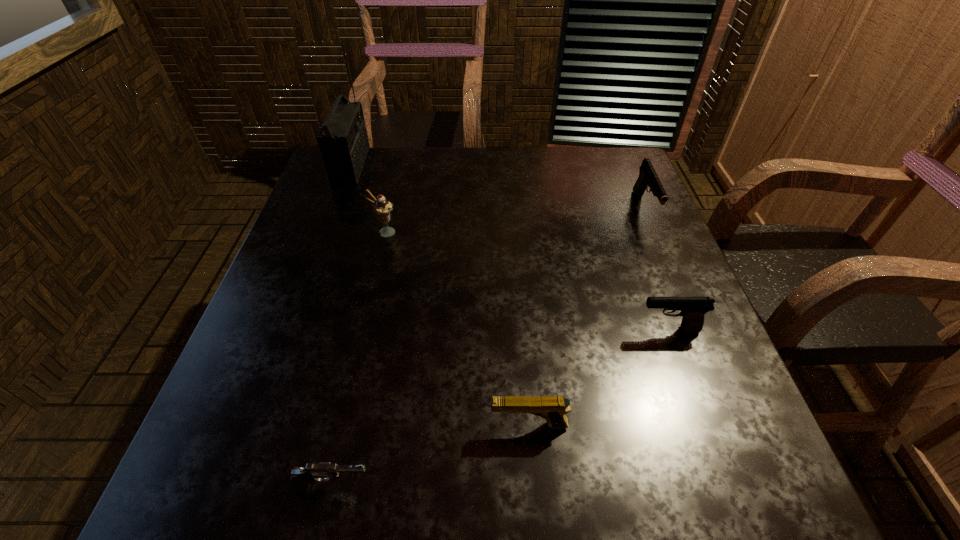
Image resolution: width=960 pixels, height=540 pixels. In order to click on pistol located at the far edge in this screenshot , I will do `click(647, 177)`.

Locate an element on the screen. This screenshot has width=960, height=540. object that is at the near edge is located at coordinates (300, 479).

At what (x,y) coordinates should I click in order to perform the action: click on object at the left edge. Please return your answer as a coordinate pair (x, y). Image resolution: width=960 pixels, height=540 pixels. Looking at the image, I should click on (343, 141).

Find the location of a particular element. This screenshot has height=540, width=960. object situated at the far left corner is located at coordinates (343, 141).

Locate an element on the screen. object at the far right corner is located at coordinates (647, 177).

You are a GUI agent. You are given a task and a screenshot of the screen. Output one action in this format:
    pyautogui.click(x=<x>, y=<y>)
    Task: Click on the free space at the far edge of the desktop
    This screenshot has height=540, width=960.
    Given the screenshot: What is the action you would take?
    pyautogui.click(x=387, y=157)

In the image, there is a desktop. Where is `vacant space at the right edge`? The image size is (960, 540). vacant space at the right edge is located at coordinates (708, 432).

You are a GUI agent. You are given a task and a screenshot of the screen. Output one action in this format:
    pyautogui.click(x=<x>, y=<y>)
    Task: Click on the vacant space at the far left corner of the desktop
    This screenshot has height=540, width=960.
    Given the screenshot: What is the action you would take?
    tap(373, 179)

In order to click on blank area at the near left corner in this screenshot , I will do 285,493.

This screenshot has height=540, width=960. Find the location of `vacant space at the far right corner`. vacant space at the far right corner is located at coordinates (602, 184).